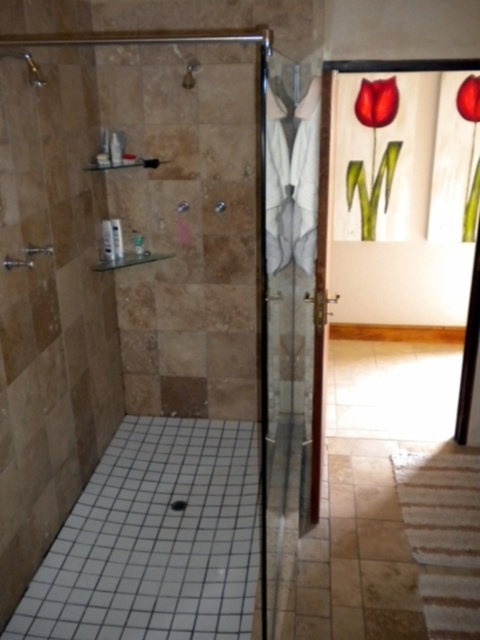
Question: Does matte wooden tulip at upper right have a smaller size compared to red glass tulip at upper right?

Choices:
 (A) no
 (B) yes

Answer: (A)

Question: Which point is farther to the camera?

Choices:
 (A) (187, 64)
 (B) (23, 48)
 (C) (307, 99)
 (D) (468, 99)

Answer: (D)

Question: Is clear glass door at center to the right of brushed metal showerhead at upper left from the viewer's perspective?

Choices:
 (A) yes
 (B) no

Answer: (A)

Question: Which point appears closest to the camera in this image?

Choices:
 (A) (466, 204)
 (B) (4, 45)
 (C) (388, 99)
 (D) (192, 60)

Answer: (B)

Question: Which point appears closest to the camera in this image?

Choices:
 (A) (465, 232)
 (B) (15, 51)
 (C) (280, 278)
 (D) (190, 61)

Answer: (B)

Question: Where is clear glass door at center located in relation to matte silver faucet at upper center in the image?

Choices:
 (A) left
 (B) right

Answer: (B)